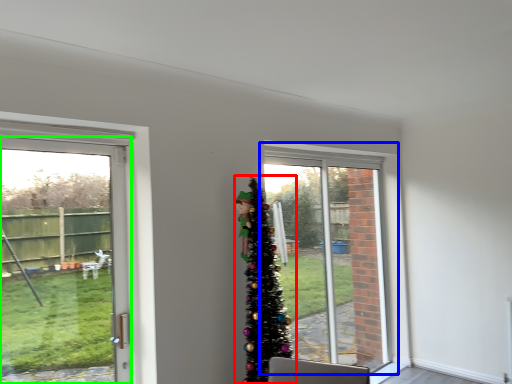
Question: Which is farther away from christmas tree (highlighted by a red box)? window (highlighted by a blue box) or door (highlighted by a green box)?

Choices:
 (A) window
 (B) door

Answer: (B)